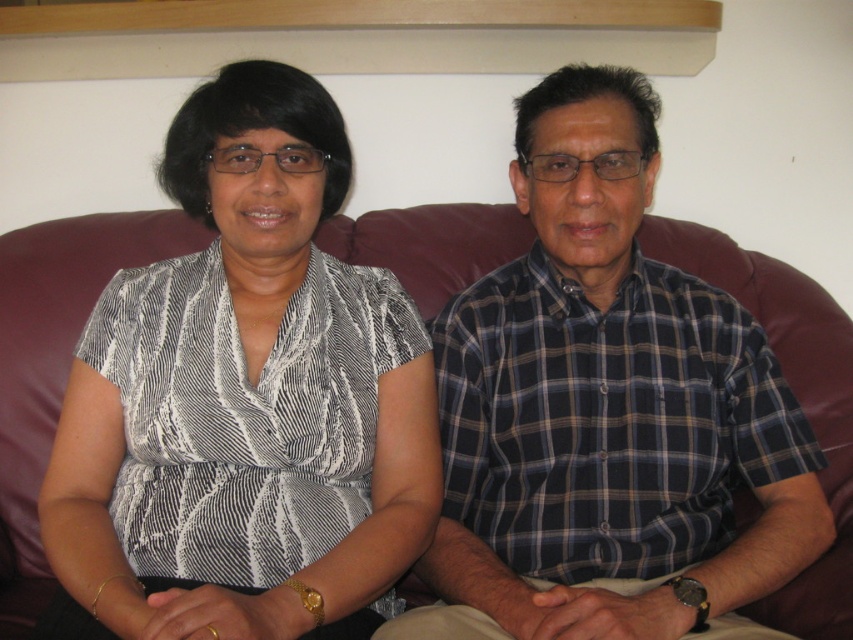
You are a photographer setting up for a portrait session. You notice the matte black blouse at left and the leather couch at center in the scene. Based on their positions, which object is closer to the camera?

The matte black blouse at left is above the leather couch at center, which means it is closer to the camera.